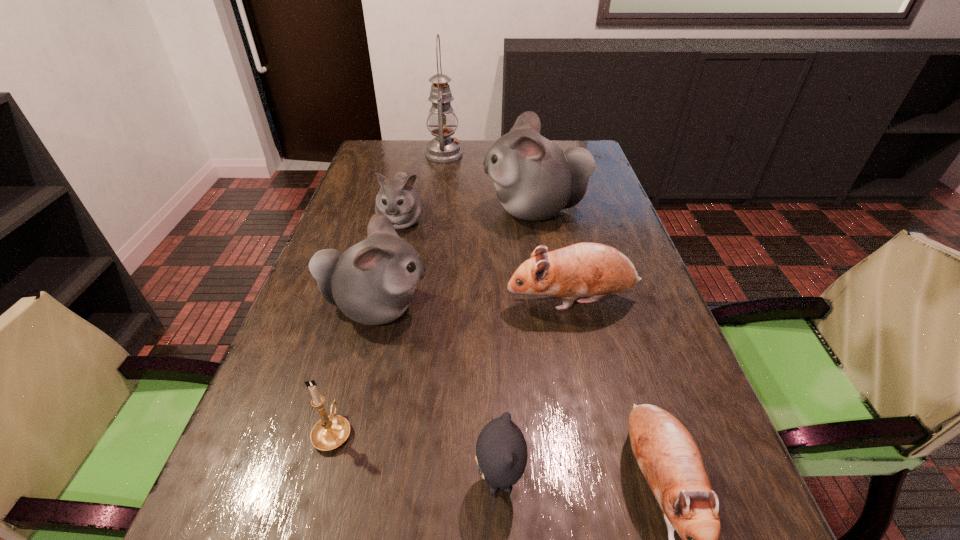
The height and width of the screenshot is (540, 960). I want to click on free location at the far left corner, so click(387, 151).

Locate an element on the screen. Image resolution: width=960 pixels, height=540 pixels. free space between the farther brown hamster and the candle holder is located at coordinates (453, 366).

I want to click on free point between the nearest white hamster and the kitten, so click(438, 395).

You are a GUI agent. You are given a task and a screenshot of the screen. Output one action in this format:
    pyautogui.click(x=<x>, y=<y>)
    Task: Click on the empty location between the gray kitten and the smallest white hamster
    The height and width of the screenshot is (540, 960).
    Given the screenshot: What is the action you would take?
    pyautogui.click(x=450, y=351)

Locate an element on the screen. object that stands as the fifth closest to the candle holder is located at coordinates (398, 199).

Image resolution: width=960 pixels, height=540 pixels. Find the location of `object that is the seventh closest to the nearest white hamster`. object that is the seventh closest to the nearest white hamster is located at coordinates (442, 120).

Identify which hamster is located as the second nearest to the tallest hamster. Please provide its 2D coordinates. Your answer should be formatted as a tuple, i.e. [(x, y)], where the tuple contains the x and y coordinates of a point satisfying the conditions above.

[(584, 269)]

I want to click on the third closest hamster relative to the nearest white hamster, so click(x=535, y=179).

Identify which white hamster is located as the second nearest to the sixth shortest object. Please provide its 2D coordinates. Your answer should be formatted as a tuple, i.e. [(x, y)], where the tuple contains the x and y coordinates of a point satisfying the conditions above.

[(535, 179)]

Where is `the closest white hamster relative to the gold candle holder`? the closest white hamster relative to the gold candle holder is located at coordinates (373, 282).